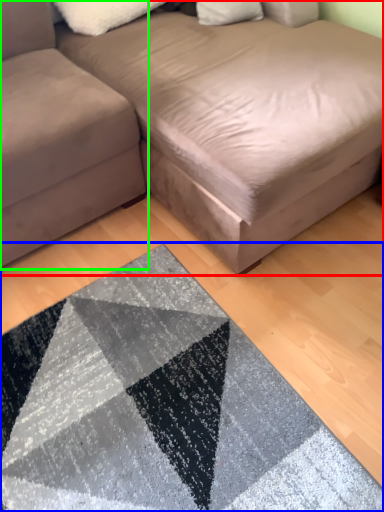
Question: Estimate the real-world distances between objects in this image. Which object is farther from studio couch (highlighted by a red box), mat (highlighted by a blue box) or studio couch (highlighted by a green box)?

Choices:
 (A) mat
 (B) studio couch

Answer: (A)